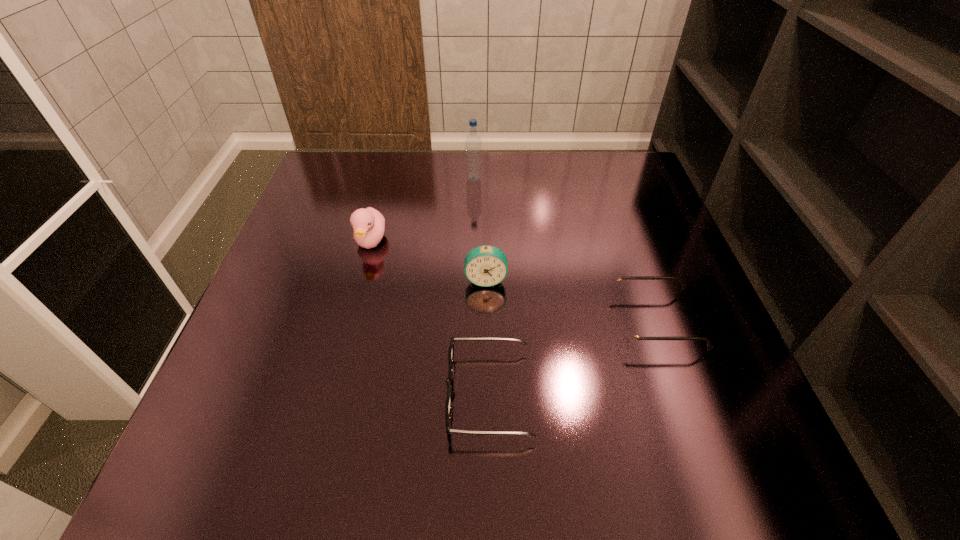
In the image, there is a desktop. Identify the location of vacant space at the near edge. (519, 437).

The width and height of the screenshot is (960, 540). Find the location of `free location at the left edge of the desktop`. free location at the left edge of the desktop is located at coordinates (324, 251).

The image size is (960, 540). In the image, there is a desktop. Identify the location of blank space at the right edge. (667, 386).

This screenshot has height=540, width=960. In the image, there is a desktop. Find the location of `vacant space at the far left corner`. vacant space at the far left corner is located at coordinates (319, 164).

This screenshot has height=540, width=960. In order to click on free location at the near left corner in this screenshot , I will do pos(230,473).

In the image, there is a desktop. Find the location of `vacant space at the far right corner`. vacant space at the far right corner is located at coordinates (589, 153).

Identify the location of vacant position at the near right corner of the desktop. (735, 459).

At what (x,y) coordinates should I click in order to perform the action: click on free area in between the right spectacles and the alarm clock. Please return your answer as a coordinate pair (x, y). The image size is (960, 540). Looking at the image, I should click on (571, 300).

You are a GUI agent. You are given a task and a screenshot of the screen. Output one action in this format:
    pyautogui.click(x=<x>, y=<y>)
    Task: Click on the vacant space that's between the left spectacles and the leftmost object
    The height and width of the screenshot is (540, 960).
    Given the screenshot: What is the action you would take?
    pyautogui.click(x=430, y=318)

I want to click on vacant space that is in between the third farthest object and the right spectacles, so click(571, 300).